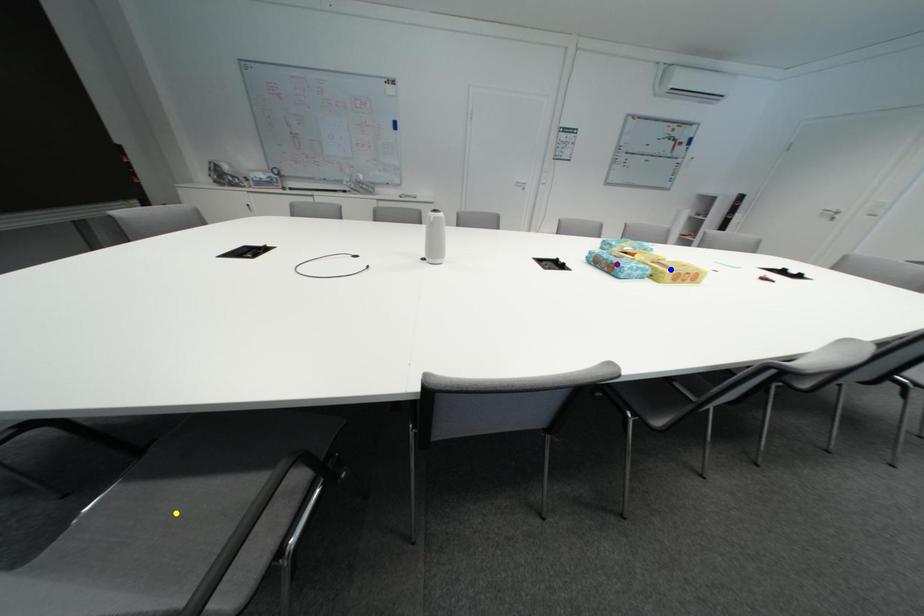
Order these from nearest to farthest:
yellow point | blue point | purple point

yellow point, blue point, purple point